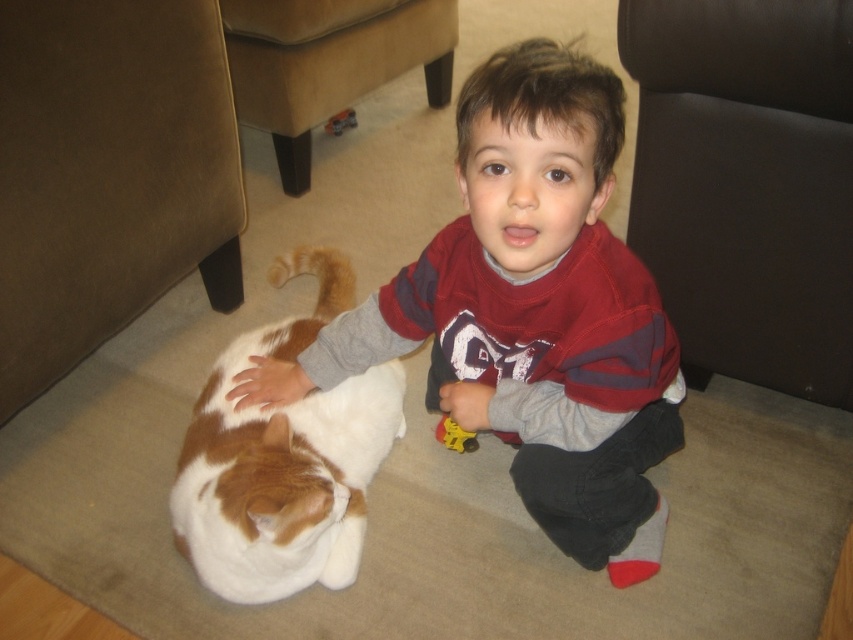
Question: Does brown leather armchair at upper right have a smaller size compared to brown leather armchair at lower center?

Choices:
 (A) yes
 (B) no

Answer: (A)

Question: Which of the following is the farthest from the observer?

Choices:
 (A) brown leather armchair at upper right
 (B) brown fabric armchair at lower left

Answer: (B)

Question: Which object is closer to the camera taking this photo?

Choices:
 (A) matte red sweatshirt at center
 (B) brown leather armchair at upper right
 (C) yellow plastic toy at center

Answer: (A)

Question: Is brown fabric armchair at lower left to the right of brown leather armchair at lower center from the viewer's perspective?

Choices:
 (A) yes
 (B) no

Answer: (B)

Question: Which of the following is the closest to the observer?

Choices:
 (A) metallic red toy car at center
 (B) brown leather armchair at upper right
 (C) brown leather armchair at lower center
 (D) brown fabric armchair at lower left

Answer: (B)

Question: Can you confirm if brown leather armchair at lower center is smaller than metallic red toy car at center?

Choices:
 (A) no
 (B) yes

Answer: (A)